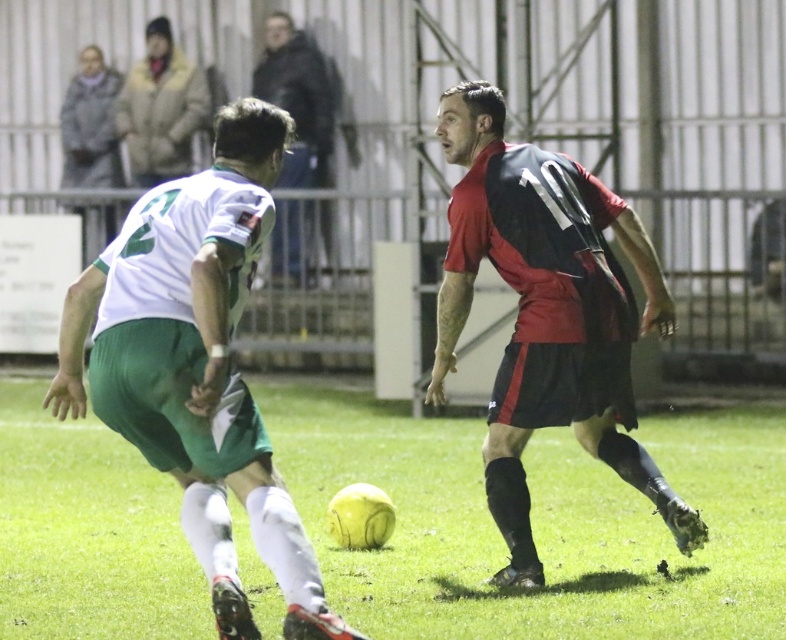
Does red matte jersey at center have a greater width compared to black fabric jacket at upper center?

Yes, red matte jersey at center is wider than black fabric jacket at upper center.

Is red matte jersey at center smaller than black fabric jacket at upper center?

Actually, red matte jersey at center might be larger than black fabric jacket at upper center.

Between point (457, 97) and point (278, 33), which one is positioned behind?

Positioned behind is point (278, 33).

In order to click on red matte jersey at center in this screenshot , I will do `click(546, 314)`.

Is the position of green matte shorts at center less distant than that of red matte jersey at center?

Yes, green matte shorts at center is in front of red matte jersey at center.

Is point (188, 234) behind point (564, 291)?

No, it is in front of (564, 291).

Does point (72, 358) come behind point (538, 236)?

No, it is not.

Where is `green matte shorts at center`? The image size is (786, 640). green matte shorts at center is located at coordinates (196, 364).

Which is above, yellow matte soccer ball at center or green matte shorts at center?

Positioned higher is green matte shorts at center.

Is yellow matte soccer ball at center smaller than green matte shorts at center?

Yes.

This screenshot has height=640, width=786. What do you see at coordinates (540, 524) in the screenshot?
I see `yellow matte soccer ball at center` at bounding box center [540, 524].

In order to click on yellow matte soccer ball at center in this screenshot , I will do `click(540, 524)`.